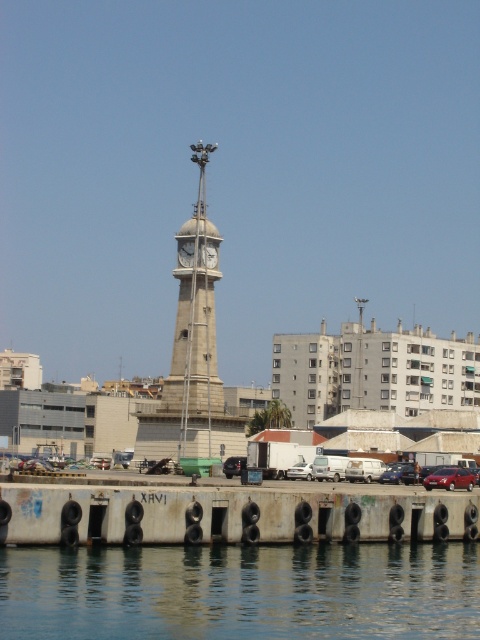
Between stone clock tower at center and white glossy clock at center, which one appears on the right side from the viewer's perspective?

From the viewer's perspective, white glossy clock at center appears more on the right side.

Is stone clock tower at center above white glossy clock at center?

Actually, stone clock tower at center is below white glossy clock at center.

Does point (215, 227) come closer to viewer compared to point (206, 243)?

No, it is not.

What are the coordinates of `stone clock tower at center` in the screenshot? It's located at (192, 356).

Who is higher up, concrete dock at lower center or white matte van at center?

concrete dock at lower center

Is point (182, 504) closer to camera compared to point (291, 467)?

Yes, point (182, 504) is in front of point (291, 467).

The height and width of the screenshot is (640, 480). I want to click on concrete dock at lower center, so click(226, 515).

Is point (357, 509) positioned behind point (470, 490)?

No, (357, 509) is closer to viewer.

Which is above, concrete dock at lower center or shiny red sedan at lower right?

concrete dock at lower center is higher up.

This screenshot has height=640, width=480. What do you see at coordinates (226, 515) in the screenshot?
I see `concrete dock at lower center` at bounding box center [226, 515].

Locate an element on the screen. concrete dock at lower center is located at coordinates (226, 515).